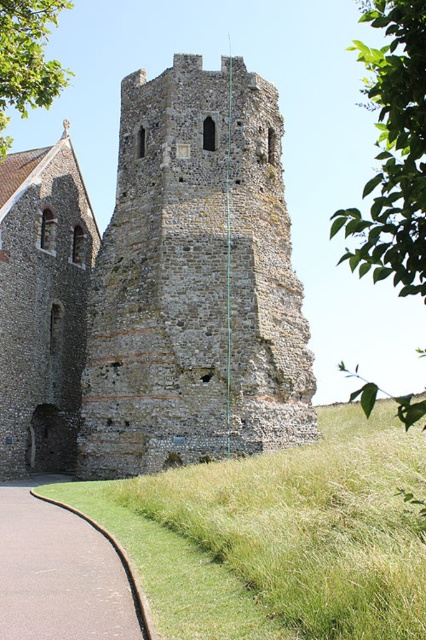
You are standing at the base of the gray stone tower at center. If you walk directly away from the tower along the paved pathway, how far will you have to walk to be exactly 50 meters away from it?

Since the gray stone tower at center is currently 49.66 meters away from the camera, you would need to walk an additional 0.34 meters away from it to reach exactly 50 meters.

Looking at this image, you are a tourist standing on the asphalt road at lower left, looking up at the gray stone tower at center. Which direction should you walk to get closer to the tower?

Since the gray stone tower at center is located above the asphalt road at lower left, you should walk upward along the asphalt road at lower left to get closer to the tower.

From the picture: You are standing at the center of the paved pathway that curves around the base of the gray stone tower at center. If you walk straight ahead, will you eventually reach the tower?

Yes, because the gray stone tower at center is positioned at point (155, 289), which is directly ahead along the pathway, so walking straight will lead you to the tower.